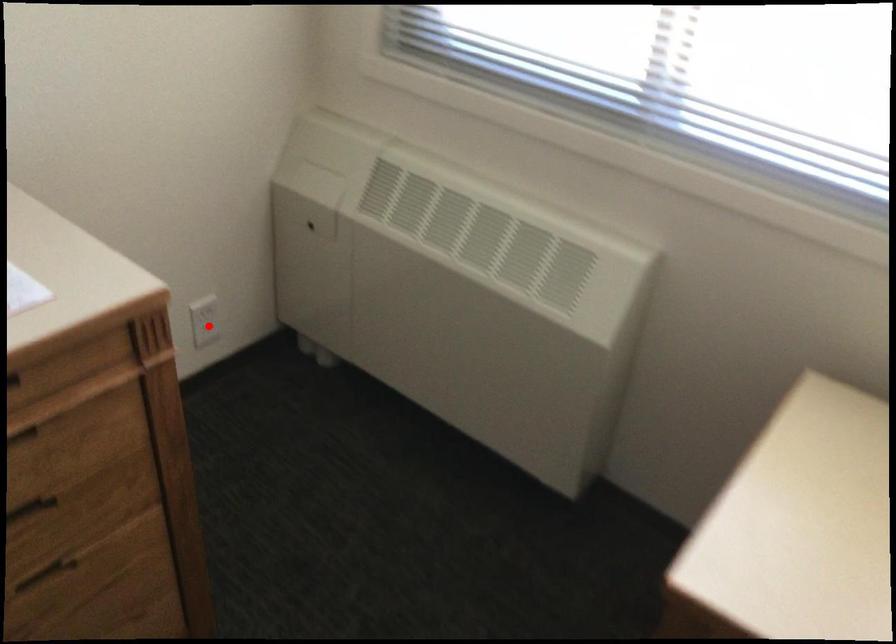
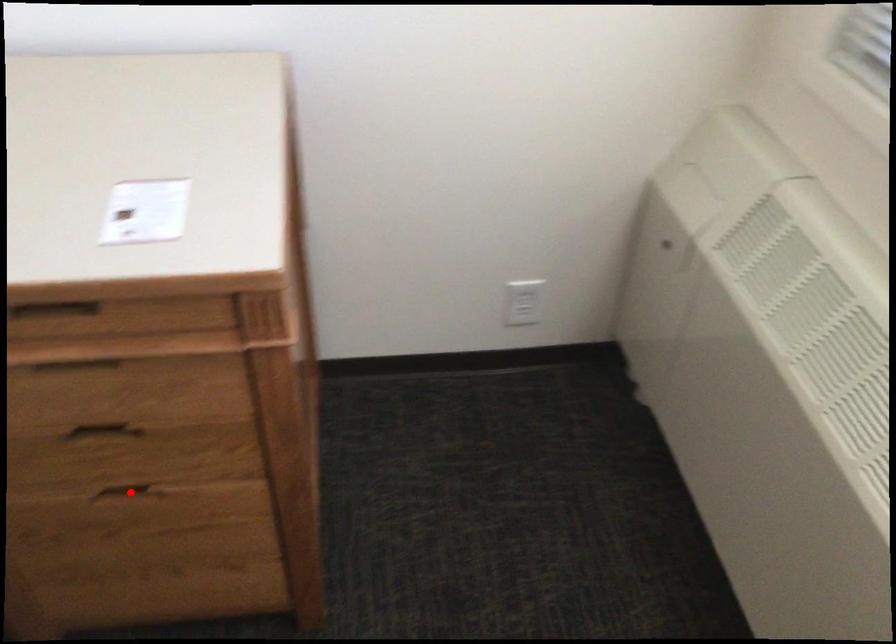
I am providing you with two images of the same scene from different viewpoints. A red point is marked on the first image and another point is marked on the second image. Is the marked point in image1 the same physical position as the marked point in image2?

No